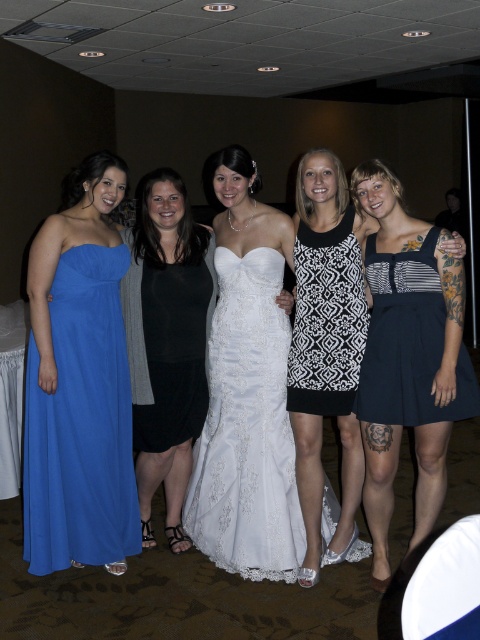
Consider the image. Is navy blue cotton dress at right taller than black and white printed dress at center?

No, navy blue cotton dress at right is not taller than black and white printed dress at center.

Is point (460, 394) farther from camera compared to point (349, 285)?

No, it is not.

Locate an element on the screen. The image size is (480, 640). navy blue cotton dress at right is located at coordinates (408, 340).

Find the location of a particular element. navy blue cotton dress at right is located at coordinates (408, 340).

Who is taller, white lace dress at center or black matte dress at center?

With more height is black matte dress at center.

Does point (208, 390) lie in front of point (130, 355)?

No, (208, 390) is further to viewer.

Measure the distance between white lace dress at center and camera.

white lace dress at center and camera are 8.87 feet apart from each other.

I want to click on white lace dress at center, so click(x=247, y=428).

Between black matte dress at center and navy blue cotton dress at right, which one is positioned higher?

navy blue cotton dress at right is above.

Does black matte dress at center have a greater width compared to navy blue cotton dress at right?

In fact, black matte dress at center might be narrower than navy blue cotton dress at right.

Who is more distant from viewer, (202, 282) or (419, 305)?

Positioned behind is point (202, 282).

Locate an element on the screen. This screenshot has height=640, width=480. black matte dress at center is located at coordinates (167, 342).